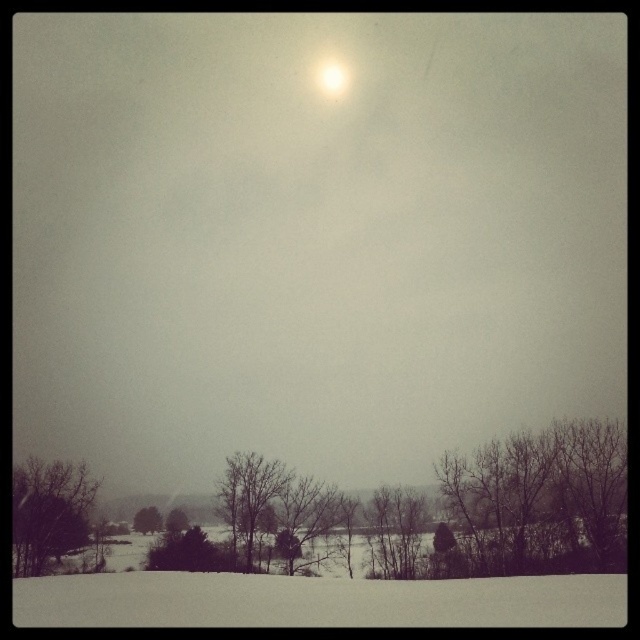
Is bare branches at lower right above bare branches at center?

Yes.

Which is in front, point (536, 484) or point (225, 460)?

Point (536, 484) is in front.

Locate an element on the screen. bare branches at lower right is located at coordinates (540, 499).

Who is more distant from viewer, [61,481] or [141,513]?

Point [141,513]

From the picture: Is snowy bare tree at lower left taller than bare branches at lower center?

Correct, snowy bare tree at lower left is much taller as bare branches at lower center.

Image resolution: width=640 pixels, height=640 pixels. What do you see at coordinates (49, 513) in the screenshot?
I see `snowy bare tree at lower left` at bounding box center [49, 513].

Locate an element on the screen. snowy bare tree at lower left is located at coordinates (49, 513).

Does point (524, 566) come farther from viewer compared to point (77, 524)?

No, (524, 566) is closer to viewer.

Is the position of bare branches at lower right more distant than that of snowy bare tree at lower left?

No, it is in front of snowy bare tree at lower left.

Is point (584, 536) less distant than point (38, 563)?

That is False.

Where is `bare branches at lower right`? bare branches at lower right is located at coordinates (540, 499).